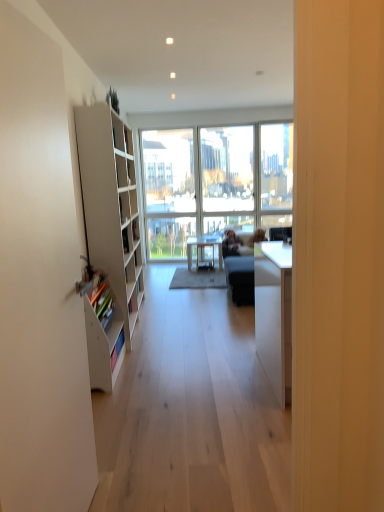
Question: Based on their sizes in the image, would you say white matte bookshelf at left is bigger or smaller than transparent glass window at center?

Choices:
 (A) small
 (B) big

Answer: (A)

Question: Is white matte bookshelf at left wider or thinner than transparent glass window at center?

Choices:
 (A) wide
 (B) thin

Answer: (B)

Question: Which object is the farthest from the light brown leather couch at center?

Choices:
 (A) transparent glass window at center
 (B) white matte screen door at left
 (C) white matte bookshelf at left
 (D) matte white table at center
 (E) white matte cabinet at left

Answer: (B)

Question: Which of these objects is positioned farthest from the white matte screen door at left?

Choices:
 (A) white matte cabinet at left
 (B) white matte bookshelf at left
 (C) light brown leather couch at center
 (D) transparent glass window at center
 (E) matte white table at center

Answer: (D)